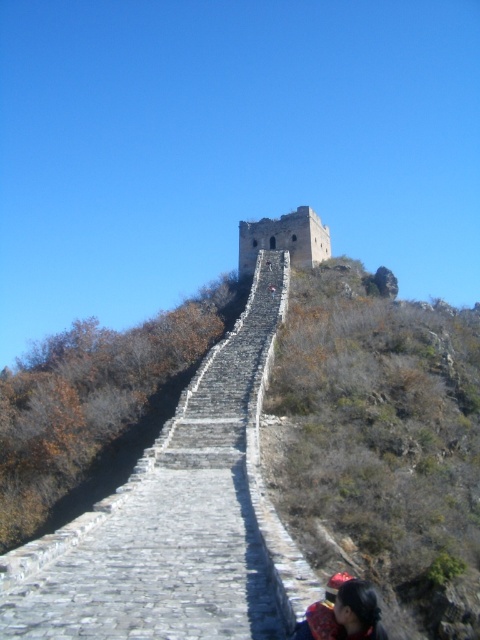
Question: Which of the following is the closest to the observer?

Choices:
 (A) (350, 468)
 (B) (343, 605)

Answer: (B)

Question: Which point is farther to the camera?

Choices:
 (A) [x=365, y=582]
 (B) [x=346, y=310]

Answer: (B)

Question: Which point appears farthest from the camera in this image?

Choices:
 (A) (455, 388)
 (B) (344, 588)

Answer: (A)

Question: Is stone wall at upper center thinner than dark brown hair at lower right?

Choices:
 (A) yes
 (B) no

Answer: (B)

Question: Does stone wall at upper center appear under dark brown hair at lower right?

Choices:
 (A) yes
 (B) no

Answer: (B)

Question: Observing the image, what is the correct spatial positioning of stone wall at upper center in reference to dark brown hair at lower right?

Choices:
 (A) left
 (B) right

Answer: (B)